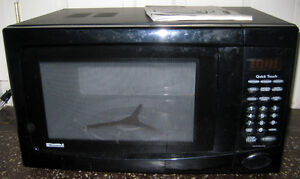
I want to click on book, so click(200, 13), click(5, 133).